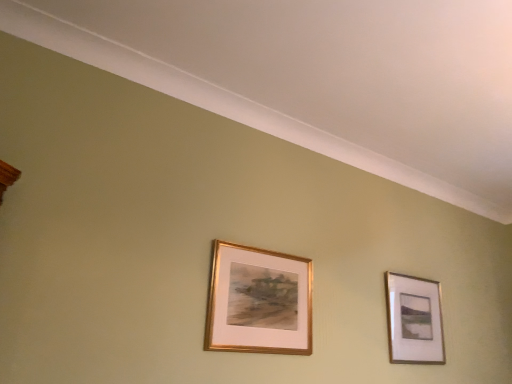
Question: Is gold metallic picture frame at upper right, arranged as the 2th picture frame when viewed from the left, placed right next to gold metallic frame at center, placed as the first picture frame when sorted from front to back?

Choices:
 (A) yes
 (B) no

Answer: (B)

Question: Is gold metallic picture frame at upper right, arranged as the 2th picture frame when viewed from the left, to the left of gold metallic frame at center, placed as the first picture frame when sorted from front to back, from the viewer's perspective?

Choices:
 (A) no
 (B) yes

Answer: (A)

Question: Is gold metallic picture frame at upper right, the 1th picture frame positioned from the right, not close to gold metallic frame at center, marked as the second picture frame in a right-to-left arrangement?

Choices:
 (A) no
 (B) yes

Answer: (A)

Question: Does gold metallic picture frame at upper right, arranged as the second picture frame when viewed from the front, have a greater height compared to gold metallic frame at center, marked as the second picture frame in a right-to-left arrangement?

Choices:
 (A) no
 (B) yes

Answer: (B)

Question: Does gold metallic picture frame at upper right, the 1th picture frame positioned from the right, turn towards gold metallic frame at center, placed as the first picture frame when sorted from front to back?

Choices:
 (A) yes
 (B) no

Answer: (B)

Question: Is gold metallic picture frame at upper right, the 1th picture frame positioned from the right, positioned with its back to gold metallic frame at center, arranged as the second picture frame when viewed from the back?

Choices:
 (A) no
 (B) yes

Answer: (A)

Question: Considering the relative sizes of gold metallic frame at center, placed as the first picture frame when sorted from front to back, and gold metallic picture frame at upper right, which ranks as the 1th picture frame in back-to-front order, in the image provided, is gold metallic frame at center, placed as the first picture frame when sorted from front to back, smaller than gold metallic picture frame at upper right, which ranks as the 1th picture frame in back-to-front order,?

Choices:
 (A) yes
 (B) no

Answer: (A)

Question: Is gold metallic frame at center, arranged as the second picture frame when viewed from the back, at the left side of gold metallic picture frame at upper right, which ranks as the 1th picture frame in back-to-front order?

Choices:
 (A) no
 (B) yes

Answer: (B)

Question: Is gold metallic frame at center, arranged as the second picture frame when viewed from the back, closer to camera compared to gold metallic picture frame at upper right, arranged as the 2th picture frame when viewed from the left?

Choices:
 (A) yes
 (B) no

Answer: (A)

Question: Is gold metallic frame at center, marked as the second picture frame in a right-to-left arrangement, bigger than gold metallic picture frame at upper right, which ranks as the 1th picture frame in back-to-front order?

Choices:
 (A) yes
 (B) no

Answer: (B)

Question: Is gold metallic frame at center, acting as the first picture frame starting from the left, wider than gold metallic picture frame at upper right, the 1th picture frame positioned from the right?

Choices:
 (A) yes
 (B) no

Answer: (B)

Question: Is gold metallic frame at center, acting as the first picture frame starting from the left, further to camera compared to gold metallic picture frame at upper right, the 1th picture frame positioned from the right?

Choices:
 (A) no
 (B) yes

Answer: (A)

Question: From the image's perspective, is gold metallic picture frame at upper right, arranged as the 2th picture frame when viewed from the left, located above or below gold metallic frame at center, placed as the first picture frame when sorted from front to back?

Choices:
 (A) above
 (B) below

Answer: (B)